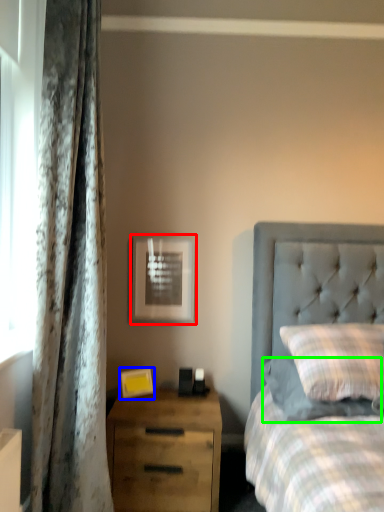
Question: Considering the real-world distances, which object is closest to picture frame (highlighted by a red box)? picture frame (highlighted by a blue box) or pillow (highlighted by a green box).

Choices:
 (A) picture frame
 (B) pillow

Answer: (A)